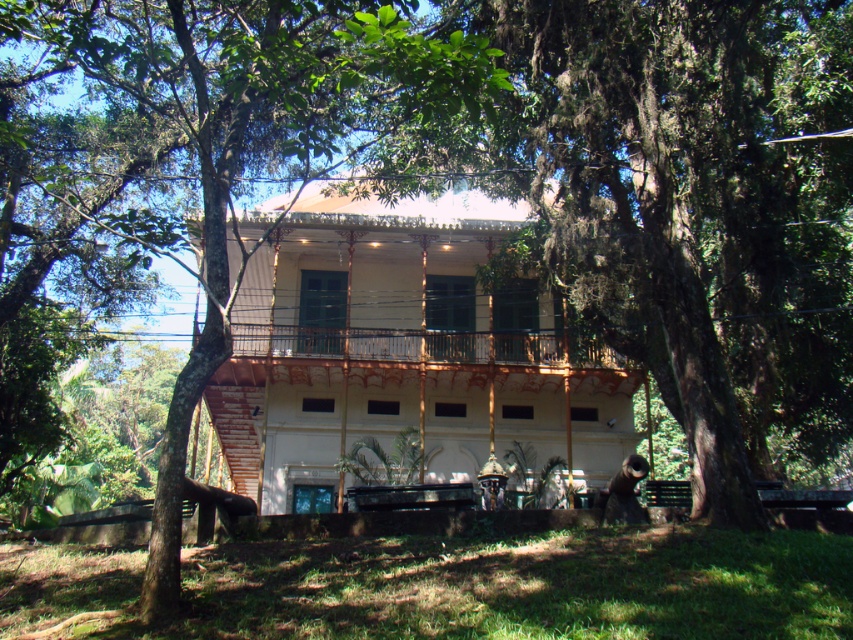
Question: Is green leafy tree at center below rustic wood porch at center?

Choices:
 (A) yes
 (B) no

Answer: (B)

Question: Is green leafy tree at center in front of rustic wood porch at center?

Choices:
 (A) yes
 (B) no

Answer: (A)

Question: Is green leafy tree at center to the left of rustic wood porch at center from the viewer's perspective?

Choices:
 (A) no
 (B) yes

Answer: (B)